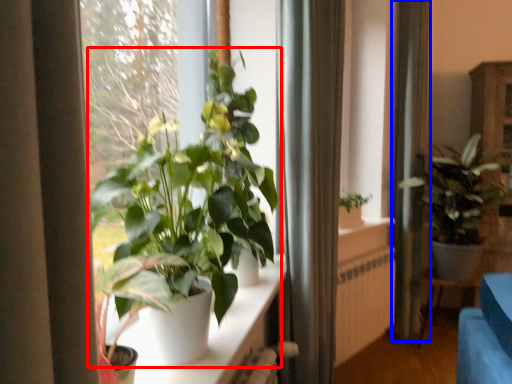
Question: Which point is further to the camera, houseplant (highlighted by a red box) or curtain (highlighted by a blue box)?

Choices:
 (A) houseplant
 (B) curtain

Answer: (B)